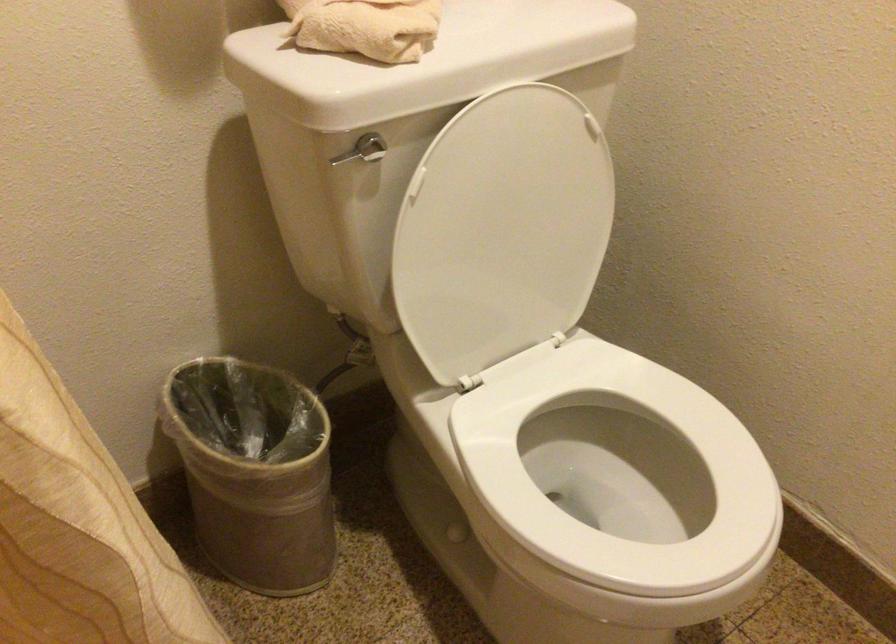
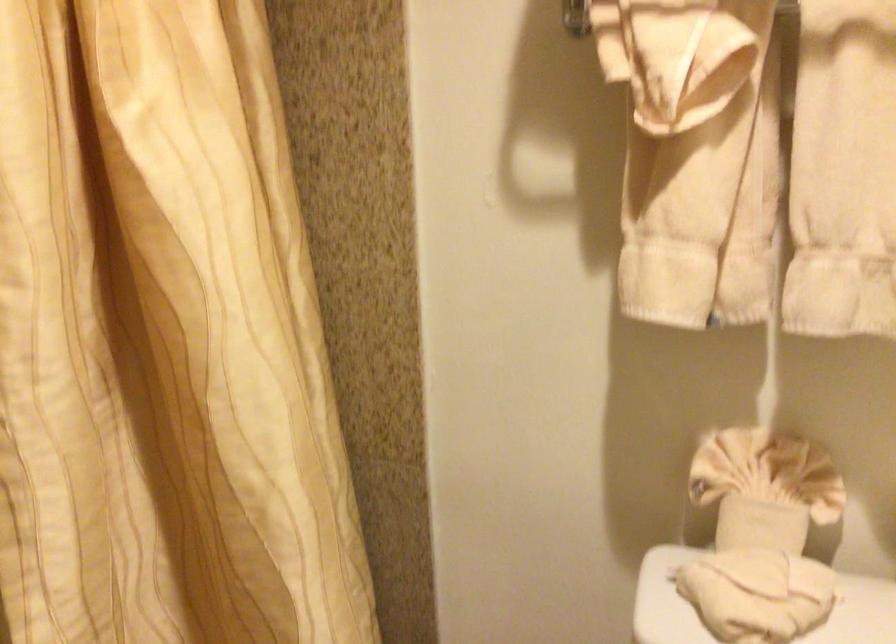
Question: Based on the continuous images, in which direction is the camera rotating? Reply with the corresponding letter.

Choices:
 (A) Left
 (B) Right
 (C) Up
 (D) Down

Answer: (A)